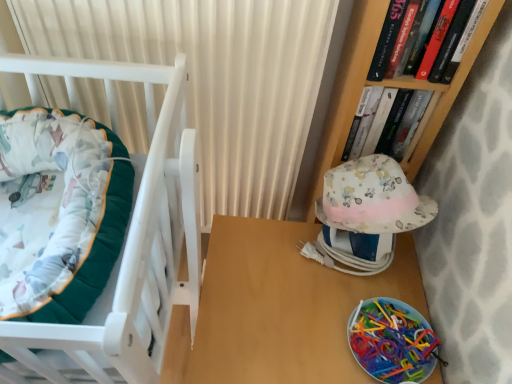
This screenshot has width=512, height=384. What are the coordinates of `vacant space behind translucent plastic plate at lower right` in the screenshot? It's located at (375, 271).